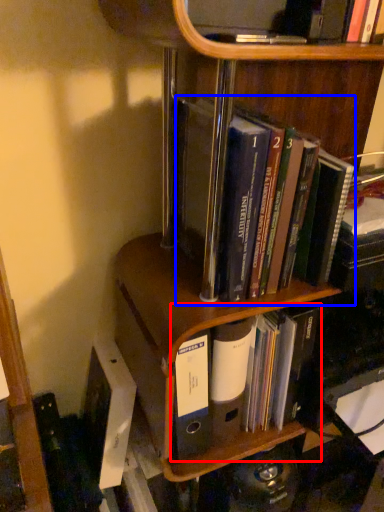
Question: Which of the following is the closest to the observer, book (highlighted by a red box) or book (highlighted by a blue box)?

Choices:
 (A) book
 (B) book

Answer: (B)